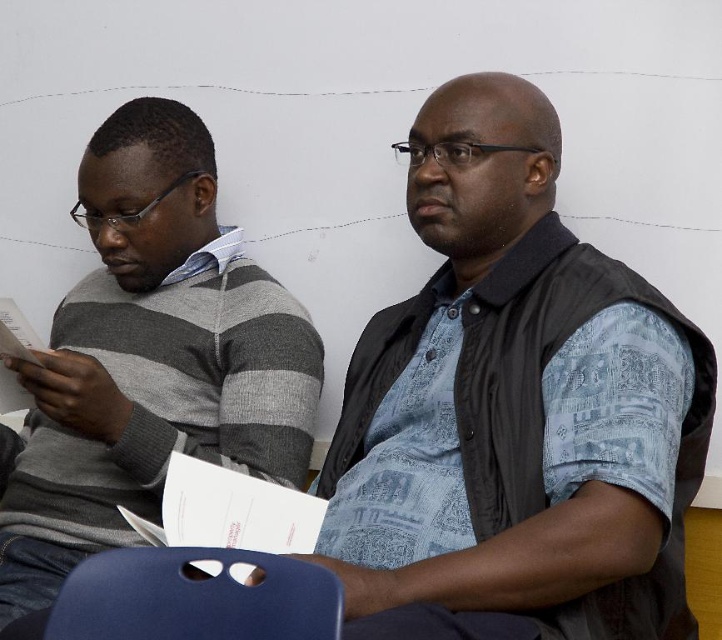
Question: Which is nearer to the blue printed shirt at center?

Choices:
 (A) matte blue chair at lower center
 (B) gray striped sweater at left

Answer: (B)

Question: Which object is positioned closest to the blue printed shirt at center?

Choices:
 (A) gray striped sweater at left
 (B) matte blue chair at lower center

Answer: (A)

Question: Considering the relative positions of blue printed shirt at center and matte blue chair at lower center in the image provided, where is blue printed shirt at center located with respect to matte blue chair at lower center?

Choices:
 (A) left
 (B) right

Answer: (B)

Question: Does gray striped sweater at left appear under matte blue chair at lower center?

Choices:
 (A) no
 (B) yes

Answer: (A)

Question: Which point is closer to the camera?

Choices:
 (A) gray striped sweater at left
 (B) blue printed shirt at center
 (C) matte blue chair at lower center

Answer: (C)

Question: Can you confirm if blue printed shirt at center is wider than gray striped sweater at left?

Choices:
 (A) yes
 (B) no

Answer: (B)